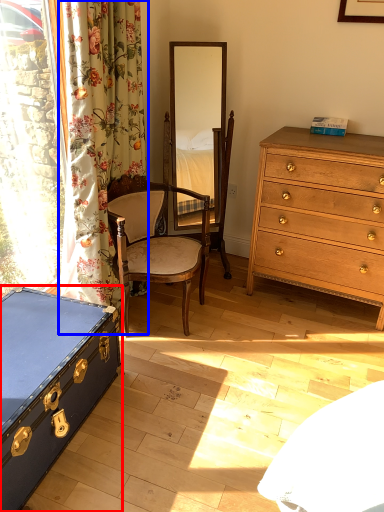
Question: Which of the following is the closest to the observer, box (highlighted by a red box) or curtain (highlighted by a blue box)?

Choices:
 (A) box
 (B) curtain

Answer: (A)